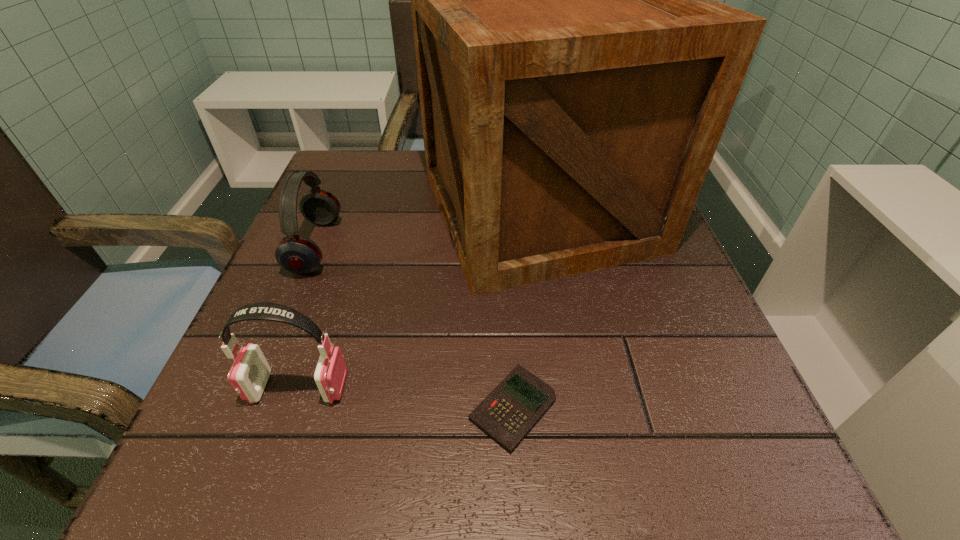
The width and height of the screenshot is (960, 540). I want to click on box, so click(576, 74).

At what (x,y) coordinates should I click in order to perform the action: click on the nearer earphone. Please return your answer as a coordinate pair (x, y). The height and width of the screenshot is (540, 960). Looking at the image, I should click on (249, 373).

The height and width of the screenshot is (540, 960). Identify the location of the farther earphone. (297, 254).

Identify the location of calculator. The image size is (960, 540). (510, 411).

This screenshot has width=960, height=540. I want to click on free point located 0.320m on the front of the tallest object, so click(x=583, y=484).

Image resolution: width=960 pixels, height=540 pixels. Identify the location of vacant point located on the outer surface of the nearer earphone. (530, 387).

At what (x,y) coordinates should I click in order to perform the action: click on free space located on the ear cups of the farther earphone. Please return your answer as a coordinate pair (x, y). This screenshot has width=960, height=540. Looking at the image, I should click on (472, 247).

This screenshot has height=540, width=960. Identify the location of free space located on the left of the calculator. (361, 408).

Locate an element on the screen. This screenshot has height=540, width=960. object that is at the far edge is located at coordinates (576, 74).

You are a GUI agent. You are given a task and a screenshot of the screen. Output one action in this format:
    pyautogui.click(x=<x>, y=<y>)
    Task: Click on the object that is positioned at the near edge
    The height and width of the screenshot is (540, 960).
    Given the screenshot: What is the action you would take?
    pyautogui.click(x=510, y=411)